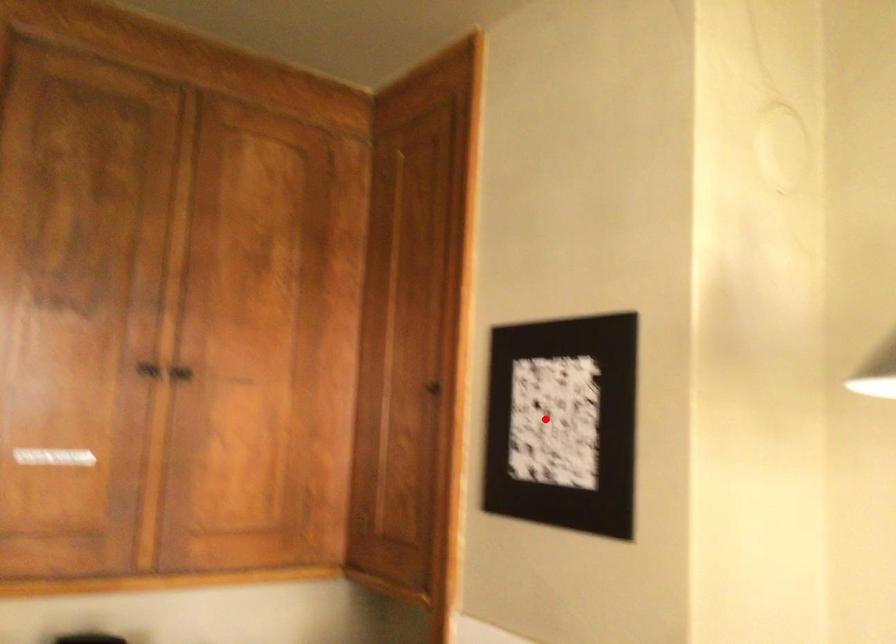
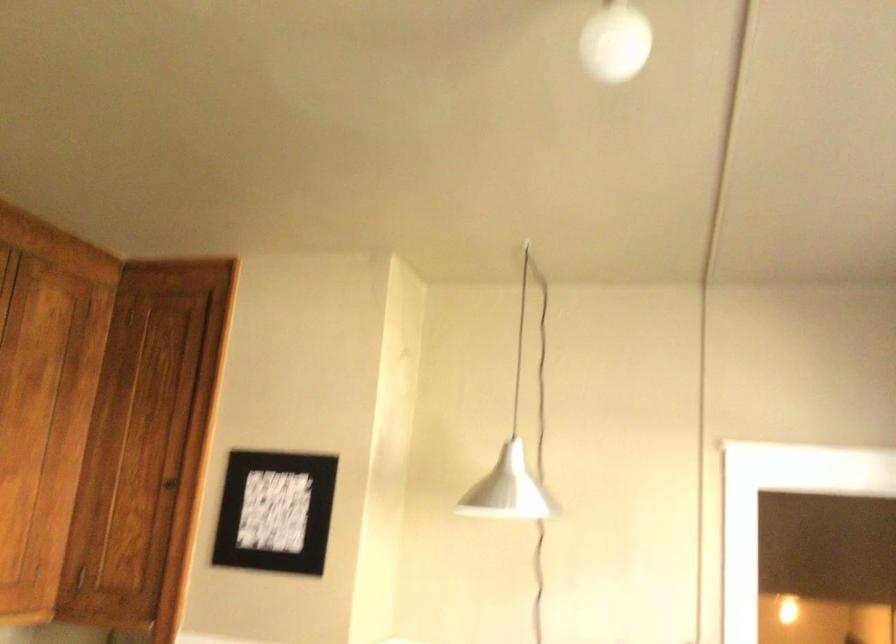
In the second image, find the point that corresponds to the highlighted location in the first image.

(274, 512)